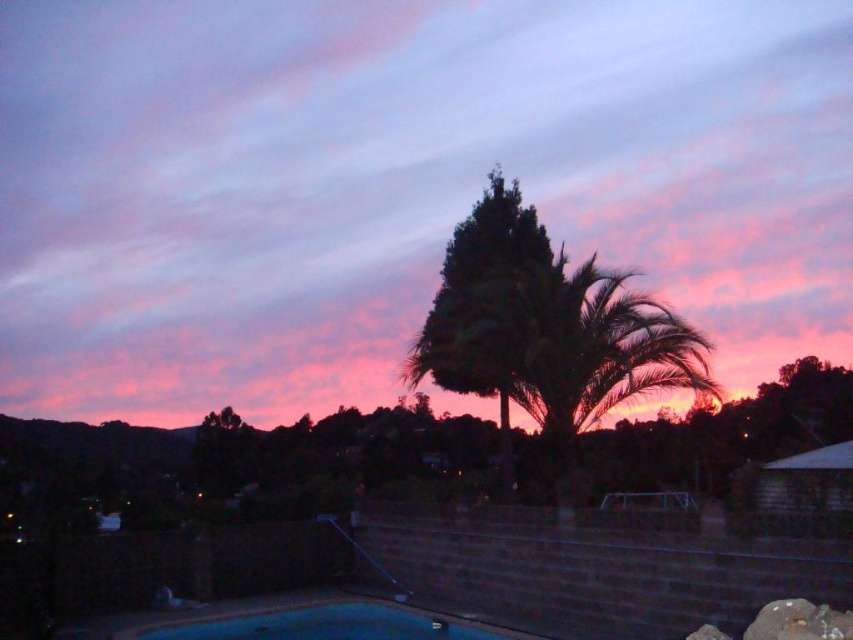
You are standing at the bottom left corner of the image where the swimming pool is located. Looking towards the silhouette leafy palm at center, in which direction should you walk to reach it?

You should walk towards the center from the bottom left corner to reach the silhouette leafy palm at center.

You are standing in the backyard and looking at the sky. You see the pink cotton candy cloud at upper center and the silhouette leafy palm at center. Which object is higher in the sky?

The pink cotton candy cloud at upper center is higher in the sky than the silhouette leafy palm at center because it is positioned above it.

You are planning to place a large inflatable flamingo in the blue smooth pool at lower center. Considering the size of the pool and the palm tree, will the silhouette leafy palm at center block the view of the flamingo from the grassy area?

The silhouette leafy palm at center has a lesser width compared to blue smooth pool at lower center, so the palm tree is narrower than the pool. This means the flamingo placed in the pool should be visible from the grassy area as the palm tree won not block the view due to its smaller width.